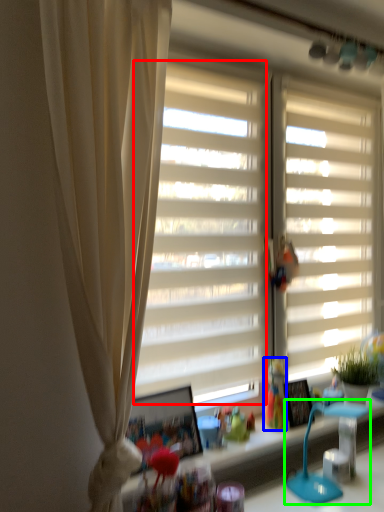
Question: Based on their relative distances, which object is farther from window screen (highlighted by a red box)? Choose from toy (highlighted by a blue box) and table lamp (highlighted by a green box).

Choices:
 (A) toy
 (B) table lamp

Answer: (B)